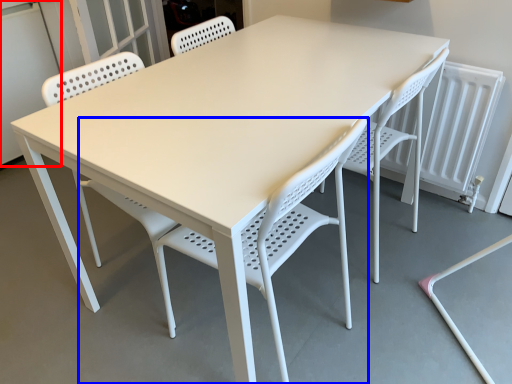
Question: Among these objects, which one is nearest to the camera, screen door (highlighted by a red box) or chair (highlighted by a blue box)?

Choices:
 (A) screen door
 (B) chair

Answer: (B)